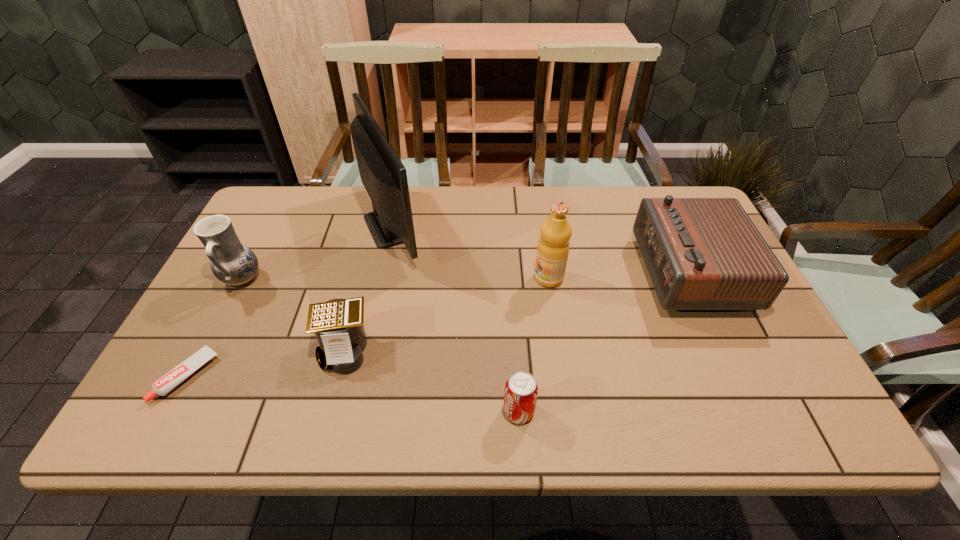
Image resolution: width=960 pixels, height=540 pixels. I want to click on object that stands as the third closest to the pottery, so 338,324.

Identify which object is the fourth closest to the calculator. Please provide its 2D coordinates. Your answer should be formatted as a tuple, i.e. [(x, y)], where the tuple contains the x and y coordinates of a point satisfying the conditions above.

[(521, 390)]

The image size is (960, 540). Find the location of `free region that satisfies the following two spatial constraints: 1. on the back side of the pottery; 2. on the right side of the toothpaste`. free region that satisfies the following two spatial constraints: 1. on the back side of the pottery; 2. on the right side of the toothpaste is located at coordinates (238, 279).

Where is `blank space that satisfies the following two spatial constraints: 1. on the front-facing side of the computer monitor; 2. on the left side of the fifth object from left to right`? blank space that satisfies the following two spatial constraints: 1. on the front-facing side of the computer monitor; 2. on the left side of the fifth object from left to right is located at coordinates (353, 411).